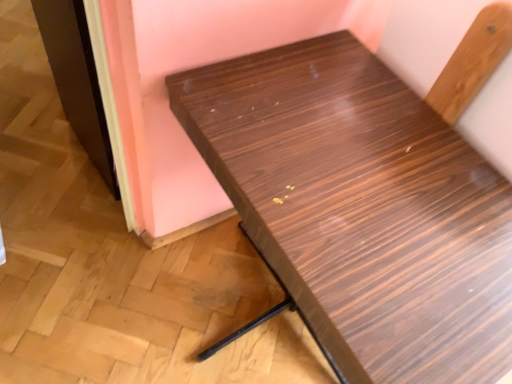
In order to click on wooden table at center in this screenshot , I will do point(361,208).

This screenshot has width=512, height=384. What do you see at coordinates (361, 208) in the screenshot?
I see `wooden table at center` at bounding box center [361, 208].

The height and width of the screenshot is (384, 512). What are the coordinates of `wooden table at center` in the screenshot? It's located at (361, 208).